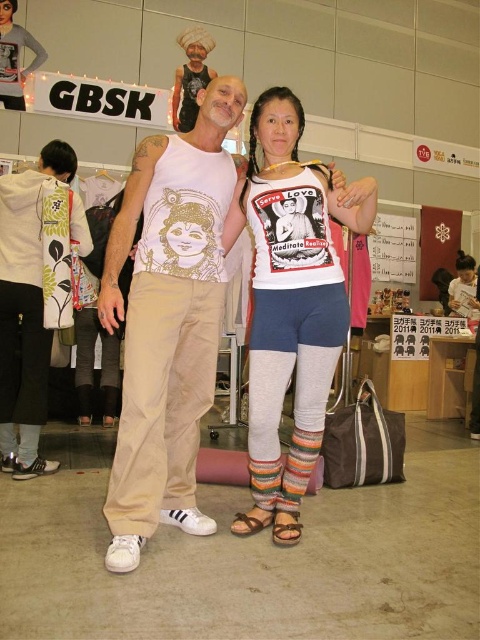
What is the object located at the coordinates point (168, 321) in the image?

The object located at point (168, 321) is the beige cotton tank top at center.

You are a photographer adjusting your camera settings to focus on two specific points in the image. The first point is at coordinates point (177, 330) and the second is at point (300, 476). Which point should you focus on first to ensure proper depth of field?

You should focus on point (177, 330) first because it is closer to the camera than point (300, 476), ensuring the closer object is in focus before adjusting for the farther one.